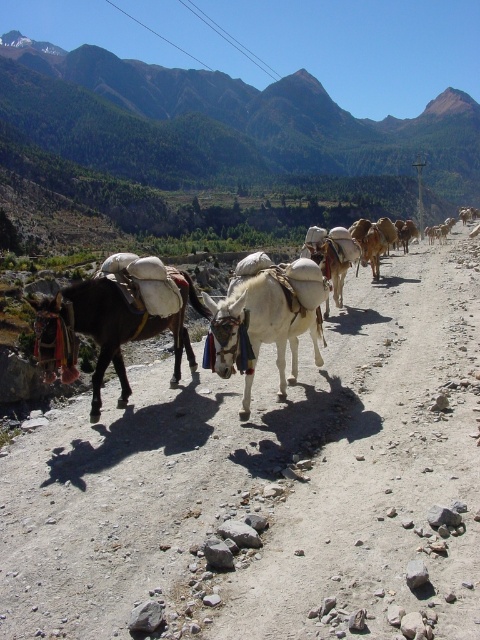
You are a hiker who wants to place a marker at point (253, 324). According to the image, what object will the marker be placed on?

The marker at point (253, 324) will be placed on the brown leather saddlebags at left.